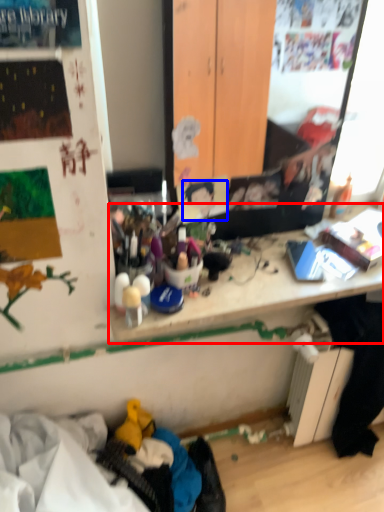
Question: Which of the following is the closest to the observer, writing desk (highlighted by a red box) or person (highlighted by a blue box)?

Choices:
 (A) writing desk
 (B) person

Answer: (A)